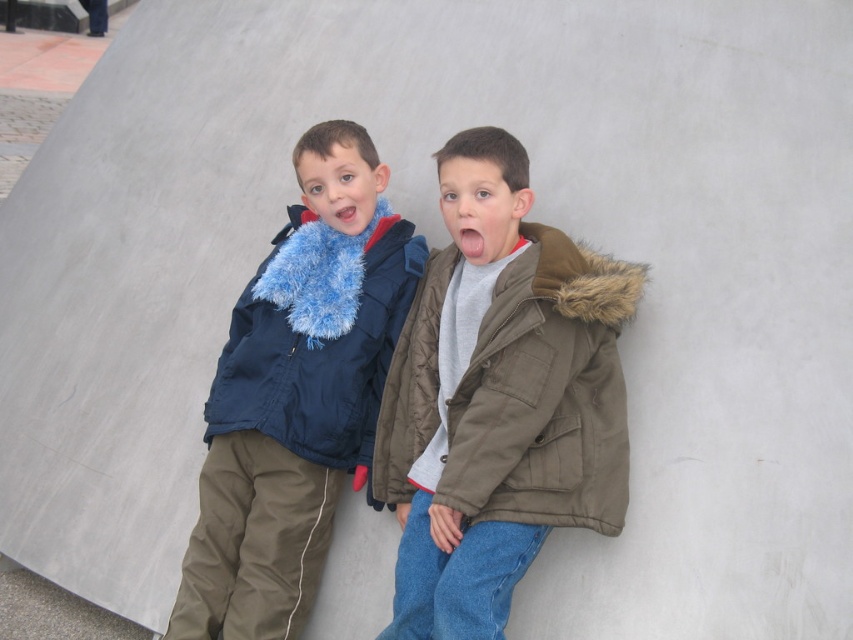
Question: Which point is farther to the camera?

Choices:
 (A) (274, 310)
 (B) (297, 280)
 (C) (590, 337)

Answer: (A)

Question: Is matte blue scarf at left positioned behind matte blue fur at left?

Choices:
 (A) no
 (B) yes

Answer: (A)

Question: Based on their relative distances, which object is farther from the matte blue fur at left?

Choices:
 (A) matte blue scarf at left
 (B) olive green quilted jacket at center

Answer: (B)

Question: Does matte blue scarf at left have a lesser width compared to matte blue fur at left?

Choices:
 (A) no
 (B) yes

Answer: (A)

Question: Can you confirm if olive green quilted jacket at center is bigger than matte blue fur at left?

Choices:
 (A) no
 (B) yes

Answer: (B)

Question: Considering the real-world distances, which object is farthest from the olive green quilted jacket at center?

Choices:
 (A) matte blue scarf at left
 (B) matte blue fur at left

Answer: (A)